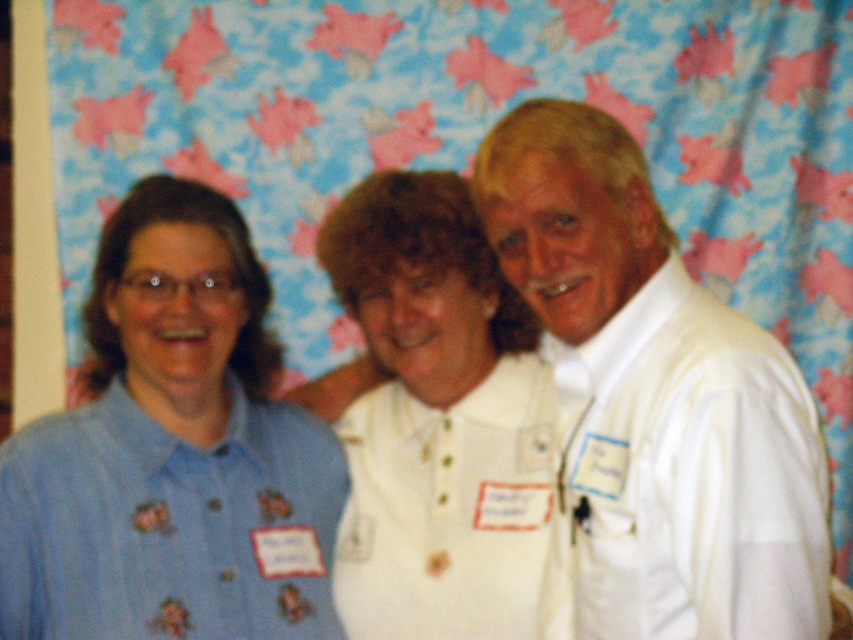
Can you confirm if blue cotton shirt at left is bigger than white satin shirt at right?

Correct, blue cotton shirt at left is larger in size than white satin shirt at right.

Is point (274, 420) closer to camera compared to point (631, 401)?

No.

Locate an element on the screen. The width and height of the screenshot is (853, 640). blue cotton shirt at left is located at coordinates (172, 452).

Based on the photo, does white cotton shirt at center have a greater width compared to white satin shirt at right?

Yes.

Where is `white cotton shirt at center`? white cotton shirt at center is located at coordinates (438, 420).

Is point (476, 433) positioned behind point (579, 557)?

Yes, it is.

Identify the location of white cotton shirt at center. (438, 420).

Does blue cotton shirt at left appear under white cotton shirt at center?

Yes, blue cotton shirt at left is below white cotton shirt at center.

Is blue cotton shirt at left in front of white cotton shirt at center?

Yes, blue cotton shirt at left is in front of white cotton shirt at center.

Looking at this image, measure the distance between point (6,545) and camera.

1.48 meters

Identify the location of blue cotton shirt at left. The width and height of the screenshot is (853, 640). (172, 452).